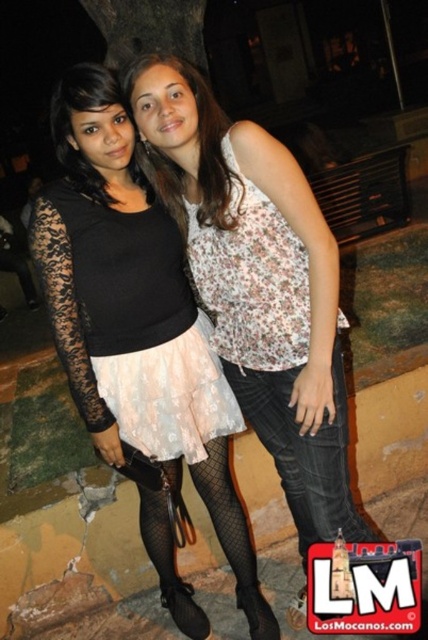
Based on the photo, between floral fabric top at center and light pink lace skirt at center, which one appears on the left side from the viewer's perspective?

light pink lace skirt at center

Does floral fabric top at center appear on the right side of light pink lace skirt at center?

Correct, you'll find floral fabric top at center to the right of light pink lace skirt at center.

The image size is (428, 640). I want to click on floral fabric top at center, so click(x=258, y=284).

Which is in front, point (163, 362) or point (323, 484)?

Positioned in front is point (323, 484).

Can you confirm if black lace skirt at center is positioned to the left of jeans at center?

Correct, you'll find black lace skirt at center to the left of jeans at center.

Between point (59, 326) and point (299, 486), which one is positioned behind?

Point (299, 486)

The image size is (428, 640). What are the coordinates of `black lace skirt at center` in the screenshot? It's located at (136, 317).

Which of these two, jeans at center or matte floral tank top at center, stands shorter?

matte floral tank top at center is shorter.

Can you confirm if jeans at center is shorter than matte floral tank top at center?

In fact, jeans at center may be taller than matte floral tank top at center.

Identify the location of jeans at center. This screenshot has height=640, width=428. (303, 451).